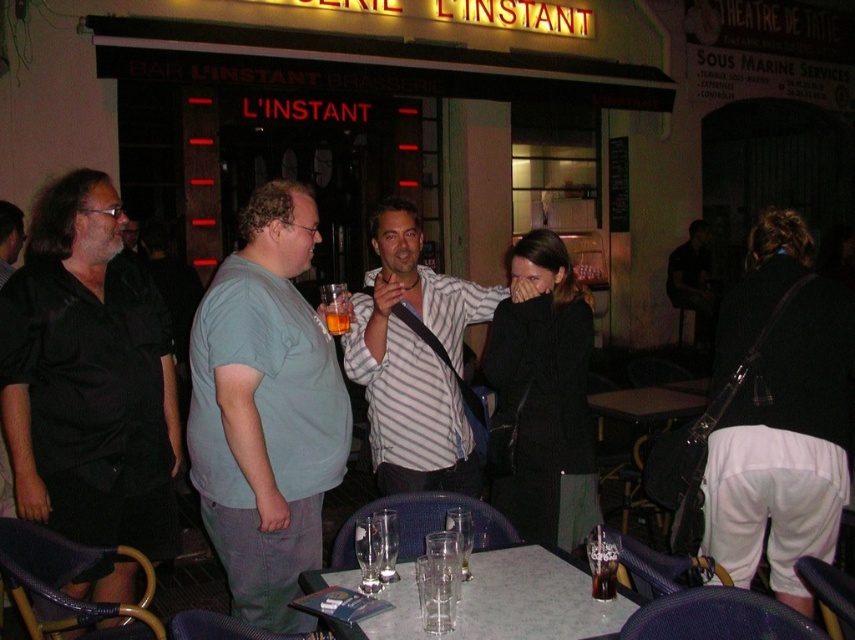
Question: Which point is farther to the camera?

Choices:
 (A) (208, 330)
 (B) (332, 320)

Answer: (B)

Question: Which point is farther to the camera?

Choices:
 (A) transparent glass at table center
 (B) translucent glass table at center
 (C) striped shirt at center
 (D) clear glass at table center

Answer: (B)

Question: From the image, what is the correct spatial relationship of black matte shirt at left in relation to white marble table at center?

Choices:
 (A) left
 (B) right

Answer: (A)

Question: Is light blue t-shirt at center closer to camera compared to translucent glass table at center?

Choices:
 (A) yes
 (B) no

Answer: (A)

Question: Can you confirm if white marble table at center is positioned to the right of translucent glass table at center?

Choices:
 (A) yes
 (B) no

Answer: (B)

Question: Which of the following is the farthest from the observer?

Choices:
 (A) (393, 563)
 (B) (270, 221)

Answer: (B)